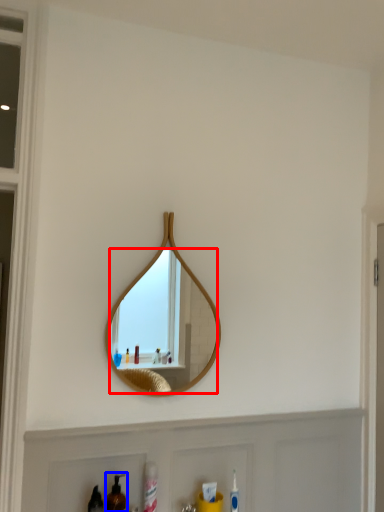
Question: Which object appears farthest to the camera in this image, mirror (highlighted by a red box) or mouthwash (highlighted by a blue box)?

Choices:
 (A) mirror
 (B) mouthwash

Answer: (A)